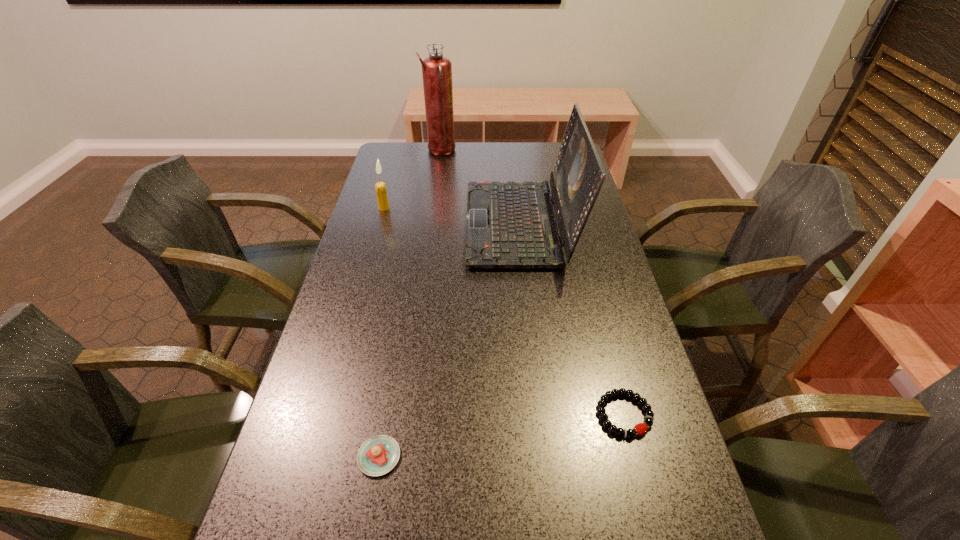
What are the coordinates of `vacant space situated 0.240m on the screen of the laptop computer` in the screenshot? It's located at (390, 224).

Locate an element on the screen. The image size is (960, 540). vacant space located on the back of the candle is located at coordinates (388, 195).

This screenshot has height=540, width=960. What are the coordinates of `vacant space located on the right of the second shortest object` in the screenshot? It's located at (574, 456).

The image size is (960, 540). What are the coordinates of `vacant space located 0.050m on the left of the bracelet` in the screenshot? It's located at 572,415.

You are a GUI agent. You are given a task and a screenshot of the screen. Output one action in this format:
    pyautogui.click(x=<x>, y=<y>)
    Task: Click on the object that is at the far edge
    The image size is (960, 540).
    Given the screenshot: What is the action you would take?
    pyautogui.click(x=436, y=69)

The width and height of the screenshot is (960, 540). In order to click on fire extinguisher that is at the left edge in this screenshot , I will do `click(436, 69)`.

Locate an element on the screen. This screenshot has width=960, height=540. candle positioned at the left edge is located at coordinates (380, 187).

The width and height of the screenshot is (960, 540). Find the location of `pastry that is positioned at the left edge`. pastry that is positioned at the left edge is located at coordinates [378, 455].

Find the location of a particular element. This screenshot has width=960, height=540. laptop computer at the right edge is located at coordinates (510, 225).

What are the coordinates of `bracelet located in the right edge section of the desktop` in the screenshot? It's located at (640, 428).